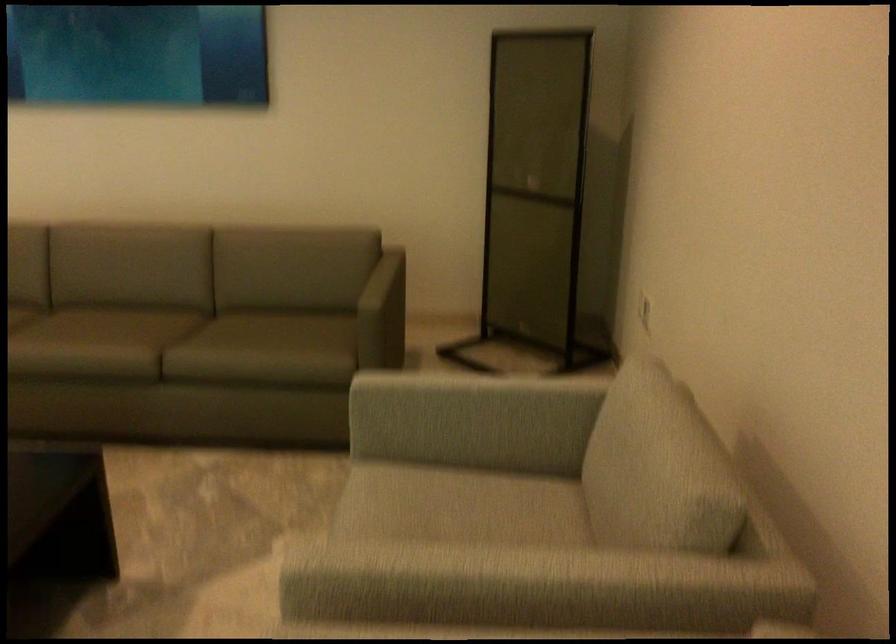
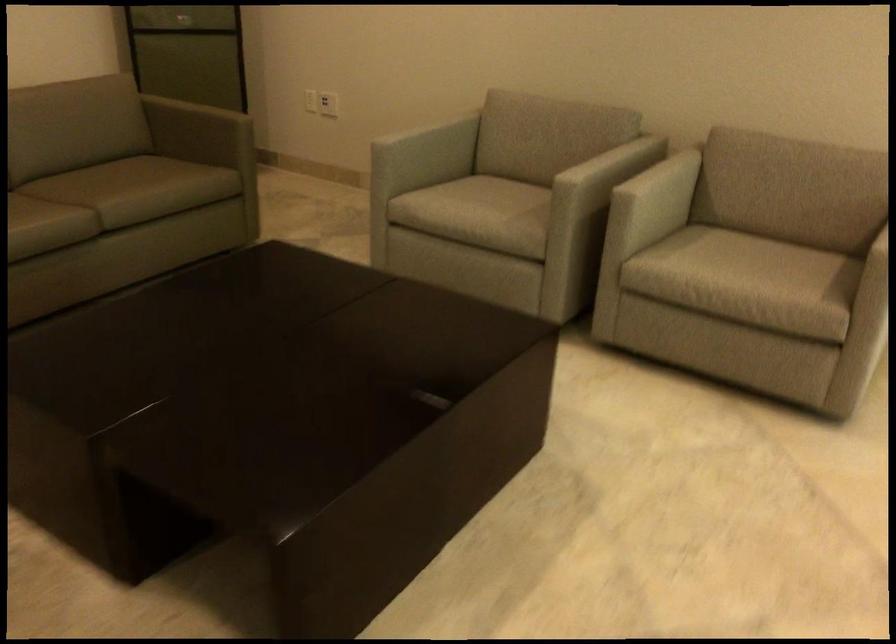
Where in the second image is the point corresponding to (x=490, y=392) from the first image?

(423, 127)